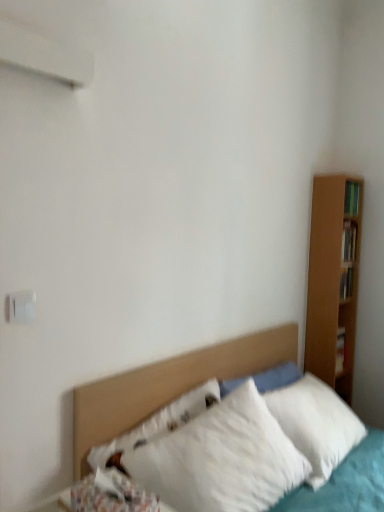
Question: Considering the relative sizes of white fluffy pillows at center and white plastic electric outlet at upper left in the image provided, is white fluffy pillows at center thinner than white plastic electric outlet at upper left?

Choices:
 (A) yes
 (B) no

Answer: (B)

Question: Can you confirm if white fluffy pillows at center is taller than white plastic electric outlet at upper left?

Choices:
 (A) no
 (B) yes

Answer: (B)

Question: Is white fluffy pillows at center oriented towards white plastic electric outlet at upper left?

Choices:
 (A) no
 (B) yes

Answer: (A)

Question: Is white fluffy pillows at center at the right side of white plastic electric outlet at upper left?

Choices:
 (A) yes
 (B) no

Answer: (A)

Question: Is white fluffy pillows at center with white plastic electric outlet at upper left?

Choices:
 (A) yes
 (B) no

Answer: (B)

Question: In terms of size, does fluffy white pillow at lower left appear bigger or smaller than white fluffy pillows at center?

Choices:
 (A) small
 (B) big

Answer: (A)

Question: Looking at their shapes, would you say fluffy white pillow at lower left is wider or thinner than white fluffy pillows at center?

Choices:
 (A) thin
 (B) wide

Answer: (A)

Question: From a real-world perspective, is fluffy white pillow at lower left physically located above or below white fluffy pillows at center?

Choices:
 (A) below
 (B) above

Answer: (B)

Question: Is fluffy white pillow at lower left situated inside white fluffy pillows at center or outside?

Choices:
 (A) inside
 (B) outside

Answer: (B)

Question: From their relative heights in the image, would you say white plastic electric outlet at upper left is taller or shorter than white fluffy pillows at center?

Choices:
 (A) tall
 (B) short

Answer: (B)

Question: Is white plastic electric outlet at upper left spatially inside white fluffy pillows at center, or outside of it?

Choices:
 (A) inside
 (B) outside

Answer: (B)

Question: In the image, is white plastic electric outlet at upper left on the left side or the right side of white fluffy pillows at center?

Choices:
 (A) left
 (B) right

Answer: (A)

Question: Does point (23, 301) appear closer or farther from the camera than point (261, 360)?

Choices:
 (A) farther
 (B) closer

Answer: (B)

Question: From their relative heights in the image, would you say fluffy white pillow at lower left is taller or shorter than white plastic electric outlet at upper left?

Choices:
 (A) tall
 (B) short

Answer: (A)

Question: From the image's perspective, is fluffy white pillow at lower left above or below white plastic electric outlet at upper left?

Choices:
 (A) above
 (B) below

Answer: (B)